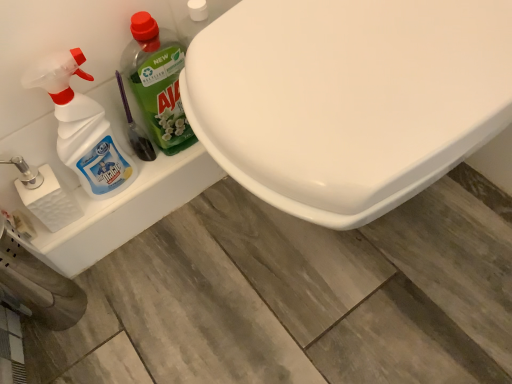
Where is `vacant space in white glossy toilet at center (from a real-world perspective)`? The image size is (512, 384). vacant space in white glossy toilet at center (from a real-world perspective) is located at coordinates (342, 243).